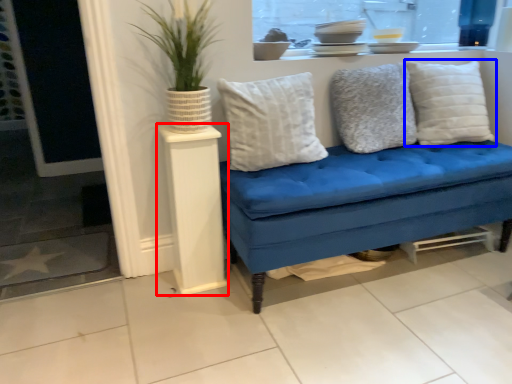
Question: Which of the following is the farthest to the observer, side table (highlighted by a red box) or pillow (highlighted by a blue box)?

Choices:
 (A) side table
 (B) pillow

Answer: (B)